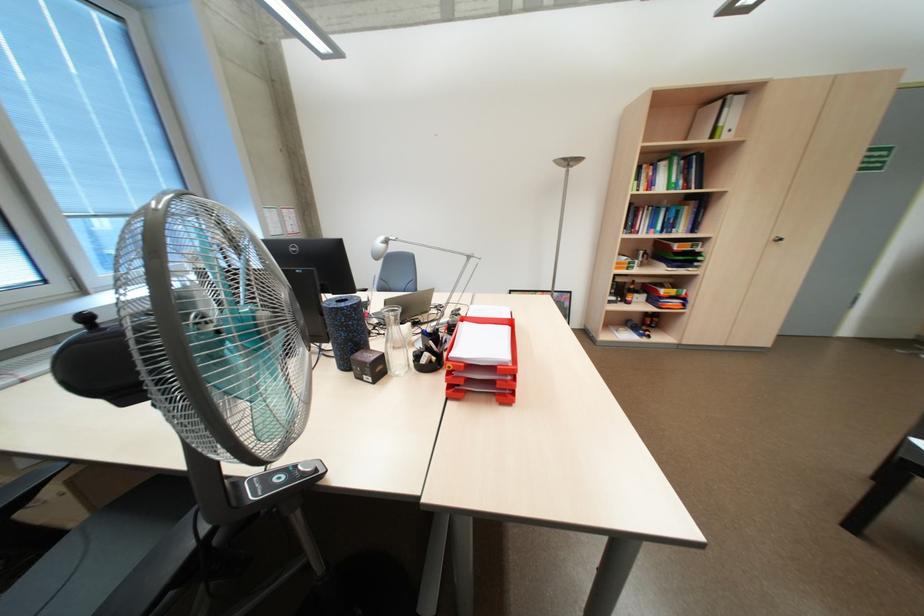
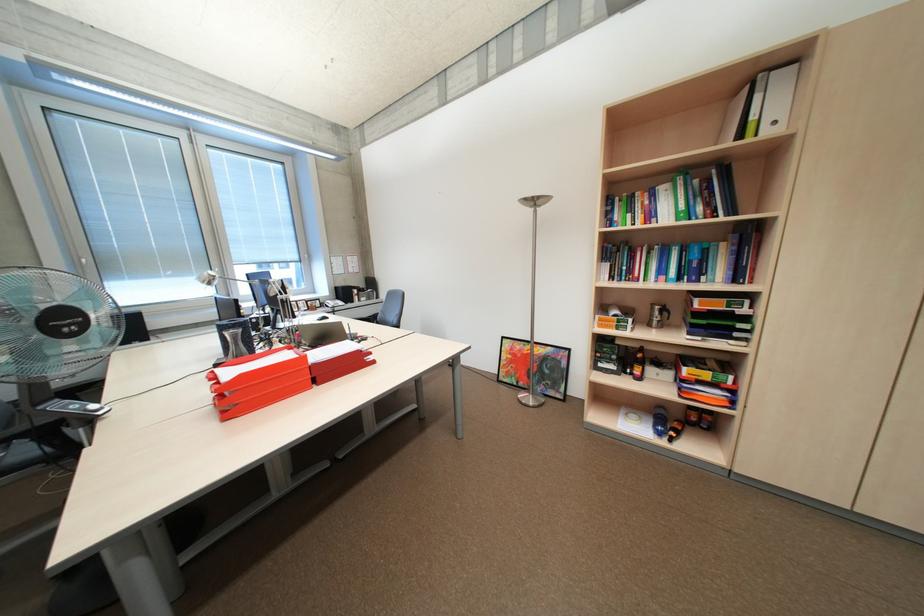
In the second image, find the point that corresponds to (x=648, y=249) in the first image.

(663, 304)